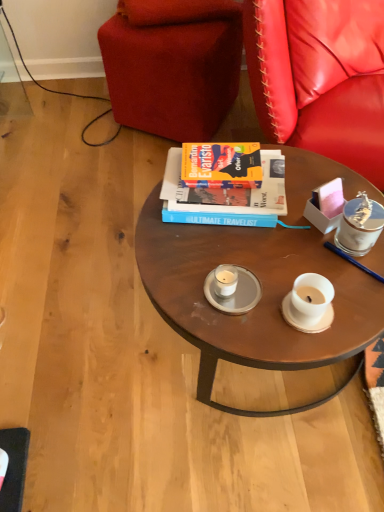
I want to click on vacant space that's between hardcover book at center and white matte candle at center, marked as the first coffee cup in a bottom-to-top arrangement, so click(230, 248).